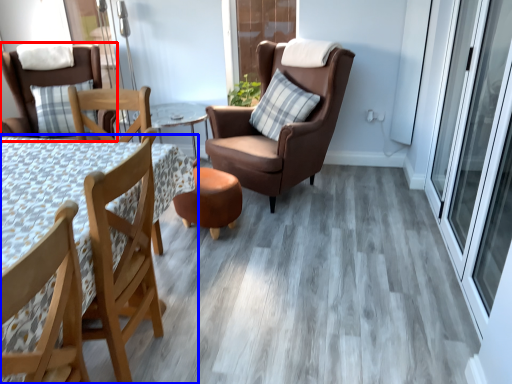
Question: Which point is closer to the camera, chair (highlighted by a red box) or table (highlighted by a blue box)?

Choices:
 (A) chair
 (B) table

Answer: (B)